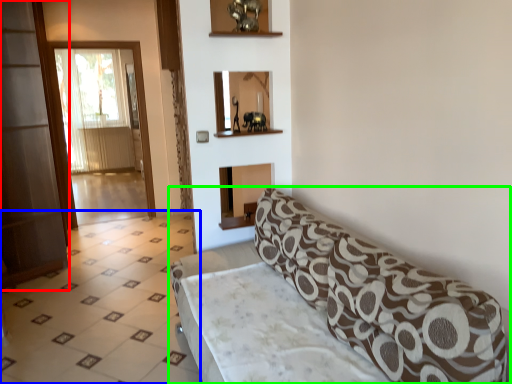
Question: Considering the real-world distances, which object is closest to screen door (highlighted by a red box)? tile (highlighted by a blue box) or studio couch (highlighted by a green box).

Choices:
 (A) tile
 (B) studio couch

Answer: (A)